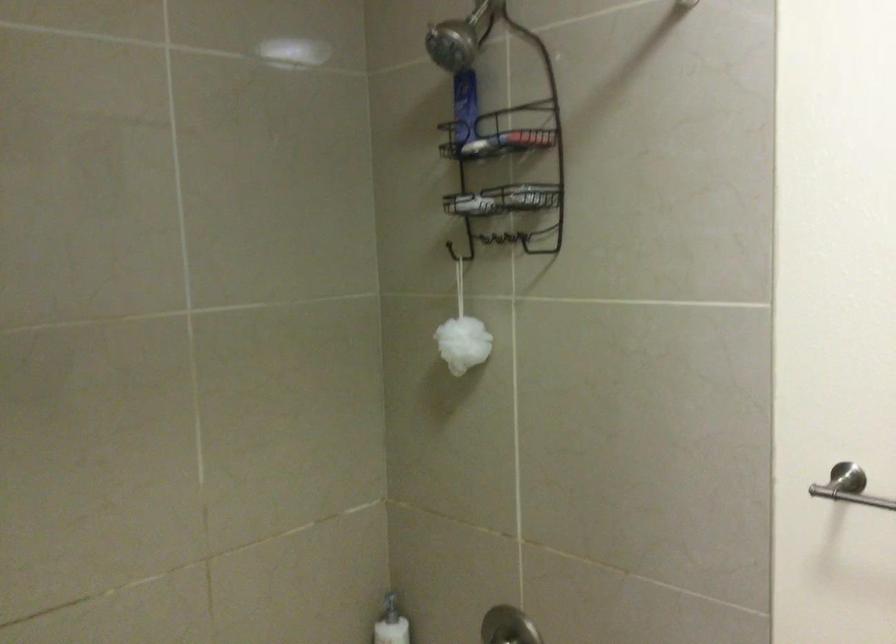
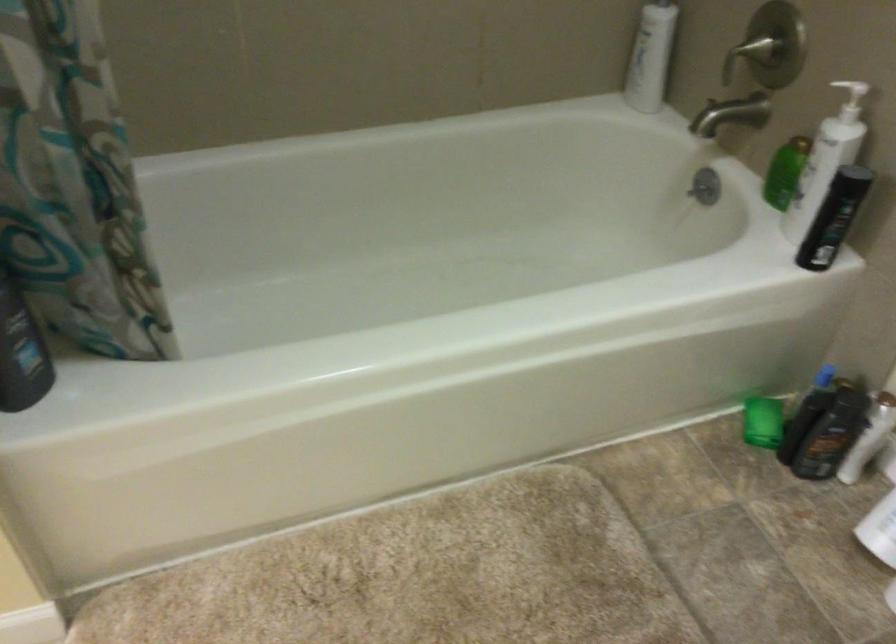
First-person continuous shooting, in which direction is the camera rotating?

The rotation direction of the camera is left-down.